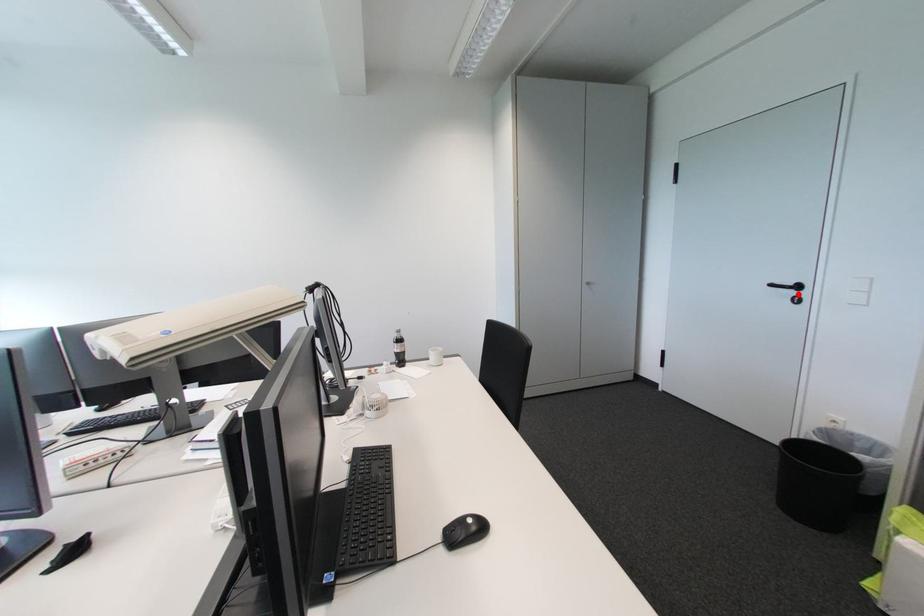
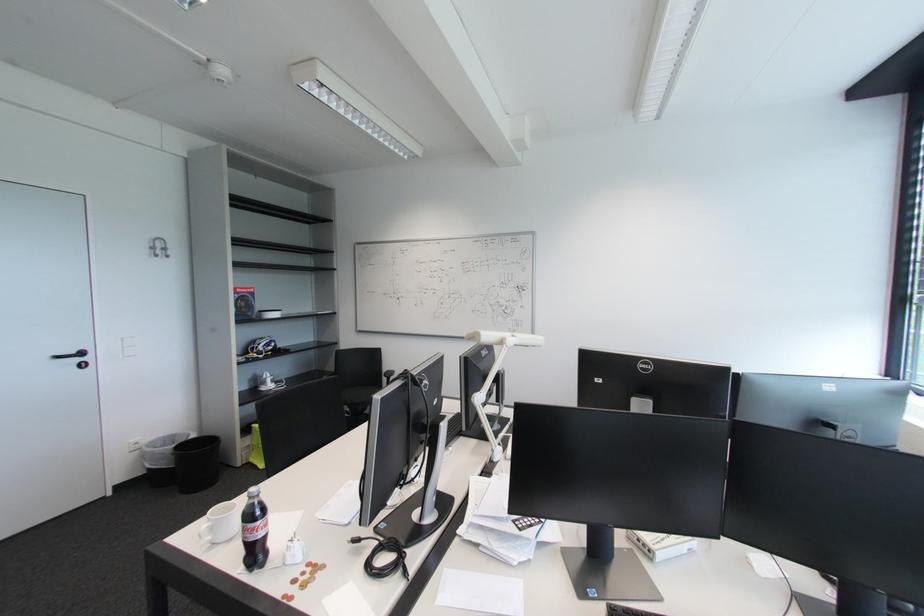
Question: I am providing you with two images of the same scene from different viewpoints. A red point is marked on the first image. Is the red point's position out of view in image 2?

Choices:
 (A) Yes
 (B) No

Answer: (B)